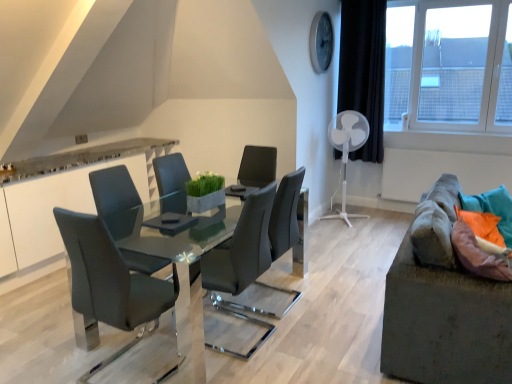
The width and height of the screenshot is (512, 384). In order to click on vacant point to the left of matte gray chair at left, the 1th chair positioned from the left in this screenshot , I will do `click(53, 355)`.